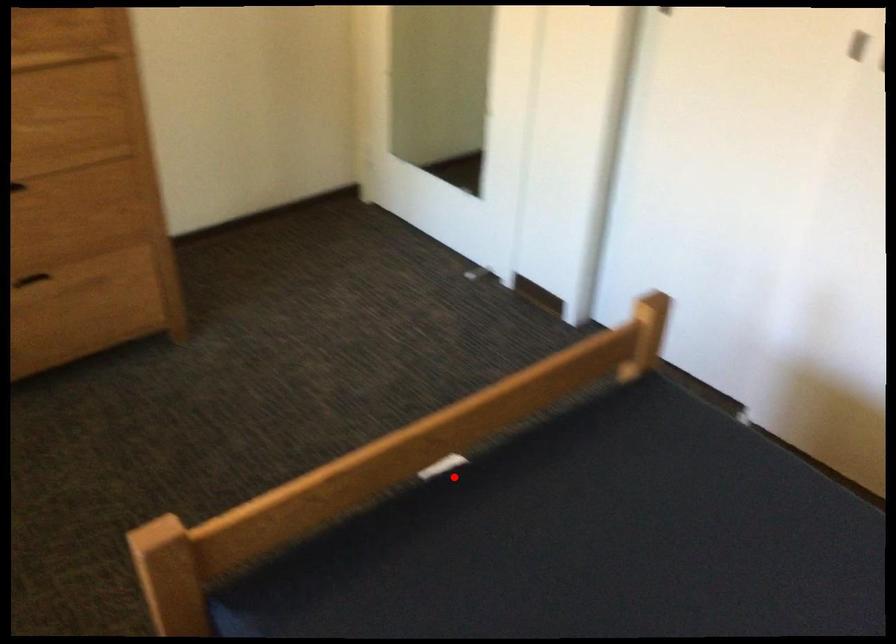
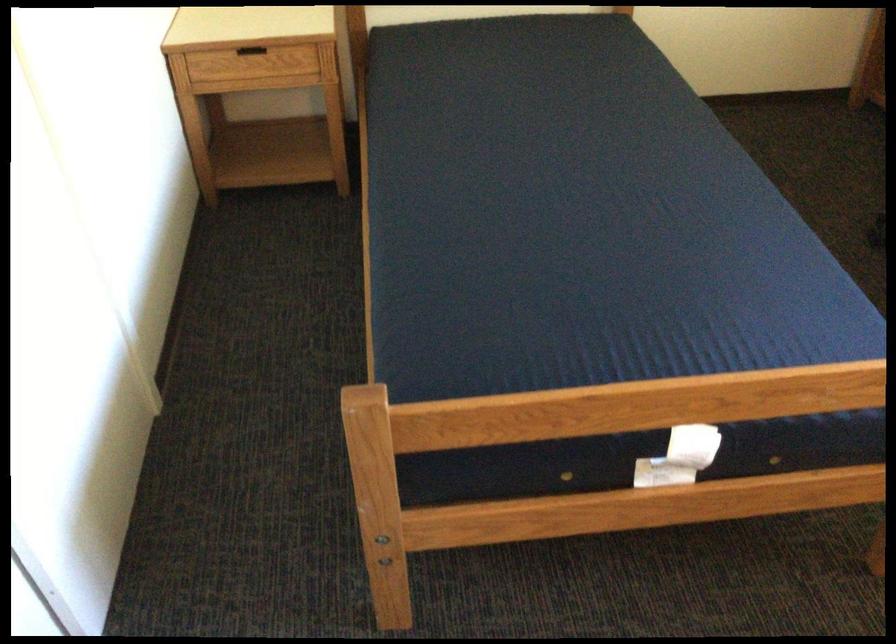
Find the pixel in the second image that matches the highlighted location in the first image.

(679, 457)